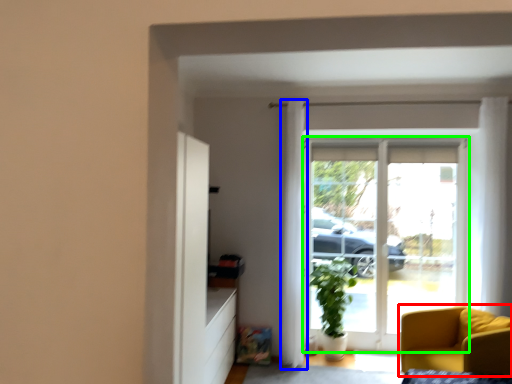
Question: Which is nearer to the chair (highlighted by a red box)? curtain (highlighted by a blue box) or door (highlighted by a green box).

Choices:
 (A) curtain
 (B) door

Answer: (B)